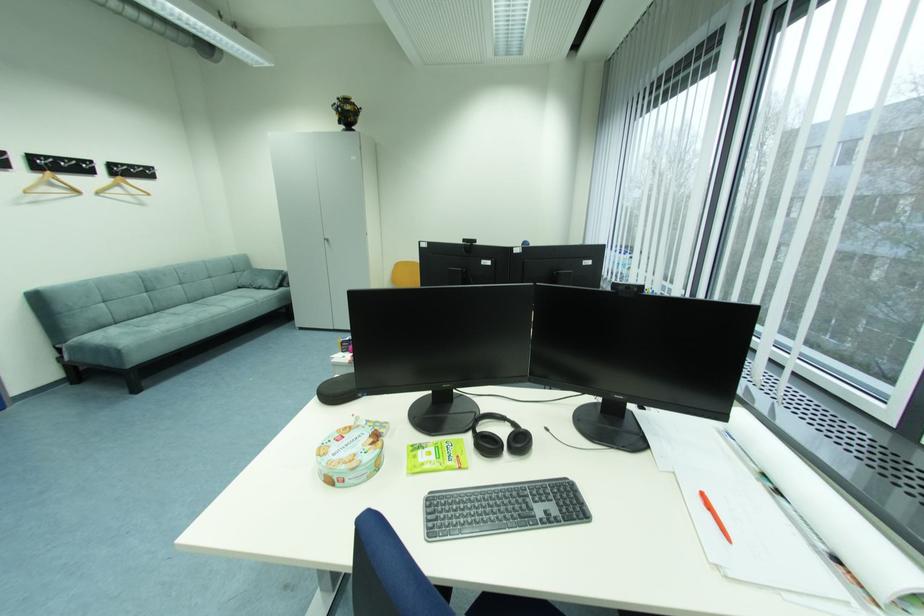
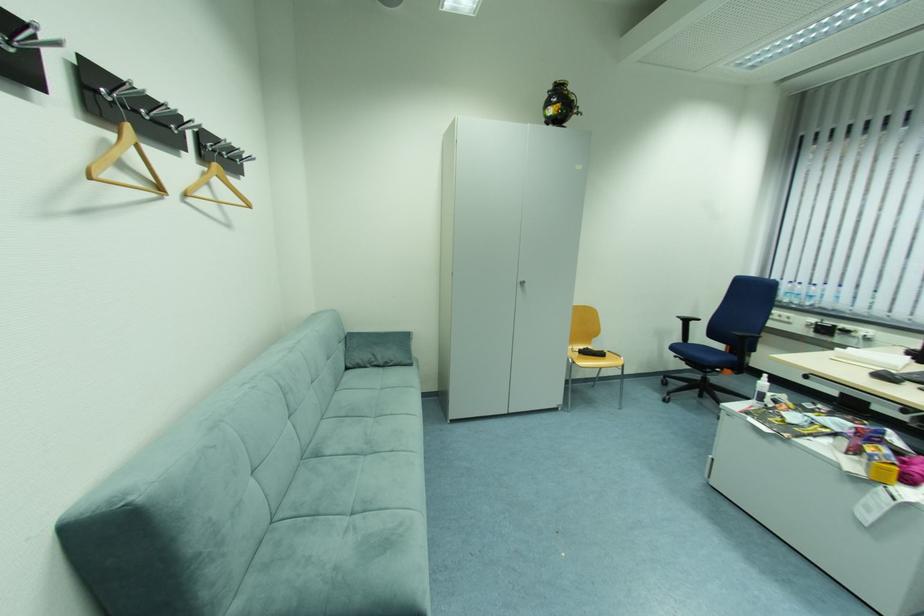
In the second image, find the point that corresponds to the point at 344,103 in the first image.

(558, 87)